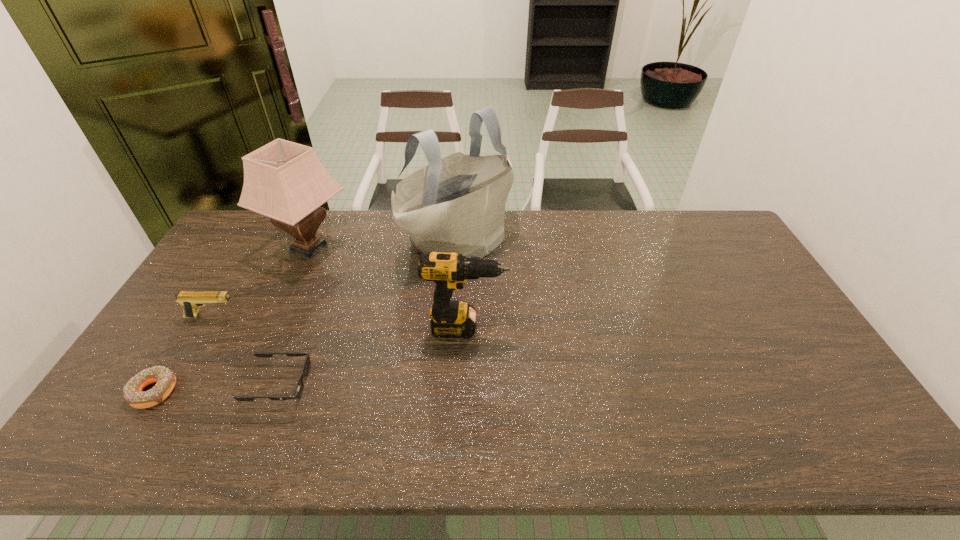
Find the location of a particular element. The image size is (960, 540). vacant area situated on the back of the doughnut is located at coordinates (177, 354).

Where is `vacant space positioned on the temples of the sunglasses`? Image resolution: width=960 pixels, height=540 pixels. vacant space positioned on the temples of the sunglasses is located at coordinates (373, 383).

At what (x,y) coordinates should I click in order to perform the action: click on shopping bag that is at the far edge. Please return your answer as a coordinate pair (x, y). Looking at the image, I should click on (456, 204).

This screenshot has height=540, width=960. What are the coordinates of `lampshade present at the far edge` in the screenshot? It's located at (283, 180).

Where is `lampshade present at the left edge`? lampshade present at the left edge is located at coordinates (283, 180).

Locate an element on the screen. pistol that is at the left edge is located at coordinates (190, 300).

This screenshot has height=540, width=960. What are the coordinates of `doughnut that is at the left edge` in the screenshot? It's located at (134, 396).

Locate an element on the screen. object that is at the far left corner is located at coordinates (283, 180).

Image resolution: width=960 pixels, height=540 pixels. What are the coordinates of `free spot at the far edge of the desktop` in the screenshot? It's located at 612,233.

The image size is (960, 540). Find the location of `vacant space at the near edge of the desktop`. vacant space at the near edge of the desktop is located at coordinates (228, 447).